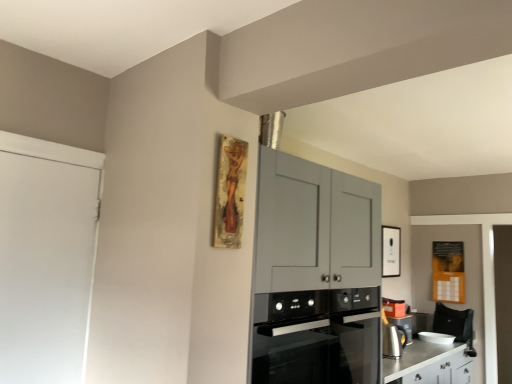
Question: Is satin silver kettle at lower right, marked as the second appliance in a back-to-front arrangement, situated inside silver metallic counter at lower right or outside?

Choices:
 (A) inside
 (B) outside

Answer: (B)

Question: In terms of width, does satin silver kettle at lower right, the 1th appliance in the front-to-back sequence, look wider or thinner when compared to silver metallic counter at lower right?

Choices:
 (A) wide
 (B) thin

Answer: (B)

Question: Which object is the closest to the silver metallic counter at lower right?

Choices:
 (A) white glossy picture frame at upper right
 (B) white glossy bowl at lower right, which ranks as the second appliance in left-to-right order
 (C) satin silver kettle at lower right, which is the second appliance from bottom to top
 (D) black glass oven at center
 (E) white matte door at left

Answer: (C)

Question: Considering the real-world distances, which object is farthest from the white glossy bowl at lower right, which ranks as the 1th appliance in back-to-front order?

Choices:
 (A) silver metallic counter at lower right
 (B) black glass oven at center
 (C) white glossy picture frame at upper right
 (D) white matte door at left
 (E) satin silver kettle at lower right, marked as the first appliance in a left-to-right arrangement

Answer: (D)